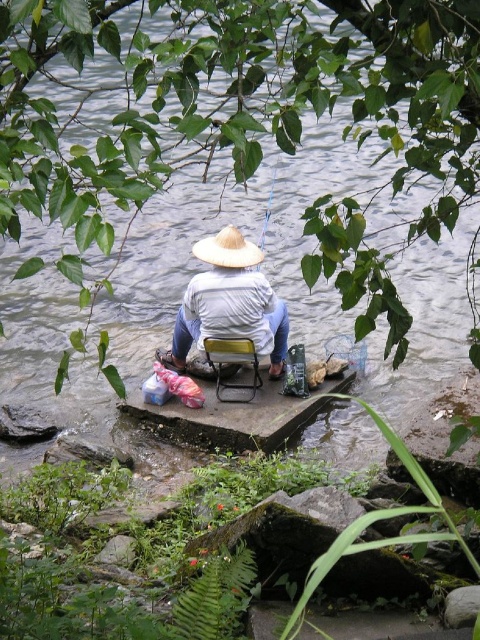
Question: Is yellow plastic chair at center thinner than white straw hat at center?

Choices:
 (A) yes
 (B) no

Answer: (A)

Question: Can you confirm if yellow plastic chair at center is positioned to the right of white straw hat at center?

Choices:
 (A) yes
 (B) no

Answer: (B)

Question: Which of the following is the farthest from the observer?

Choices:
 (A) (223, 346)
 (B) (239, 250)

Answer: (A)

Question: Which point appears closest to the camera in this image?

Choices:
 (A) (232, 353)
 (B) (193, 244)

Answer: (A)

Question: Does yellow plastic chair at center have a larger size compared to white straw hat at center?

Choices:
 (A) no
 (B) yes

Answer: (B)

Question: Which object appears farthest from the camera in this image?

Choices:
 (A) white straw hat at center
 (B) yellow plastic chair at center

Answer: (B)